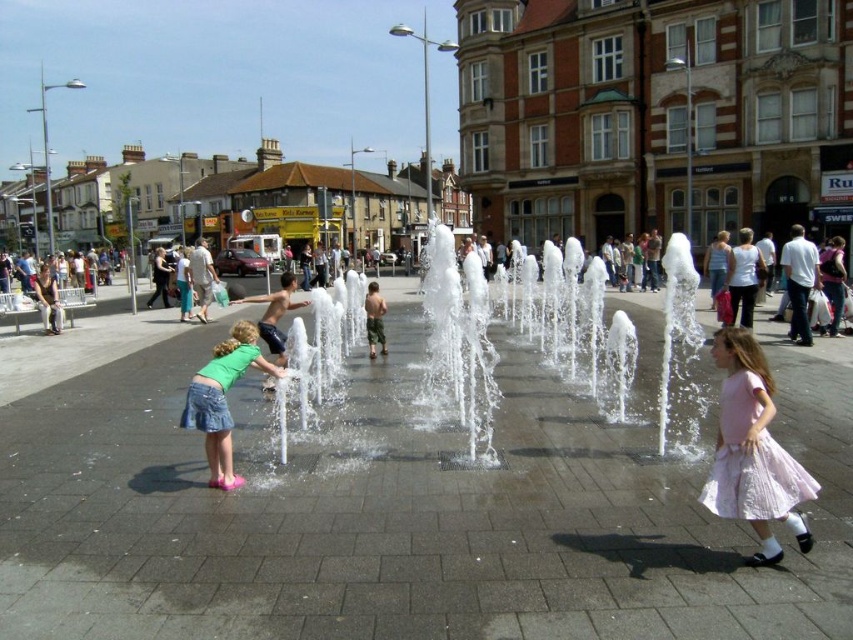
Between pink pleated skirt at lower right and white cotton tank top at center, which one is positioned lower?

pink pleated skirt at lower right is below.

Is pink pleated skirt at lower right below white cotton tank top at center?

Yes, pink pleated skirt at lower right is below white cotton tank top at center.

This screenshot has height=640, width=853. In order to click on pink pleated skirt at lower right in this screenshot , I will do `click(753, 451)`.

Between clear water jets at center and light blue denim skirt at center, which one appears on the right side from the viewer's perspective?

Positioned to the right is light blue denim skirt at center.

Does clear water jets at center lie in front of light blue denim skirt at center?

Yes, clear water jets at center is closer to the viewer.

Is point (430, 296) behind point (625, 260)?

No, (430, 296) is closer to viewer.

Image resolution: width=853 pixels, height=640 pixels. I want to click on clear water jets at center, so click(x=519, y=333).

Can you confirm if clear water jets at center is positioned to the left of green camouflage shorts at center?

In fact, clear water jets at center is to the right of green camouflage shorts at center.

Who is positioned more to the left, clear water jets at center or green camouflage shorts at center?

Positioned to the left is green camouflage shorts at center.

Which is in front, point (660, 419) or point (384, 305)?

Point (660, 419)

The width and height of the screenshot is (853, 640). Find the location of `clear water jets at center`. clear water jets at center is located at coordinates click(519, 333).